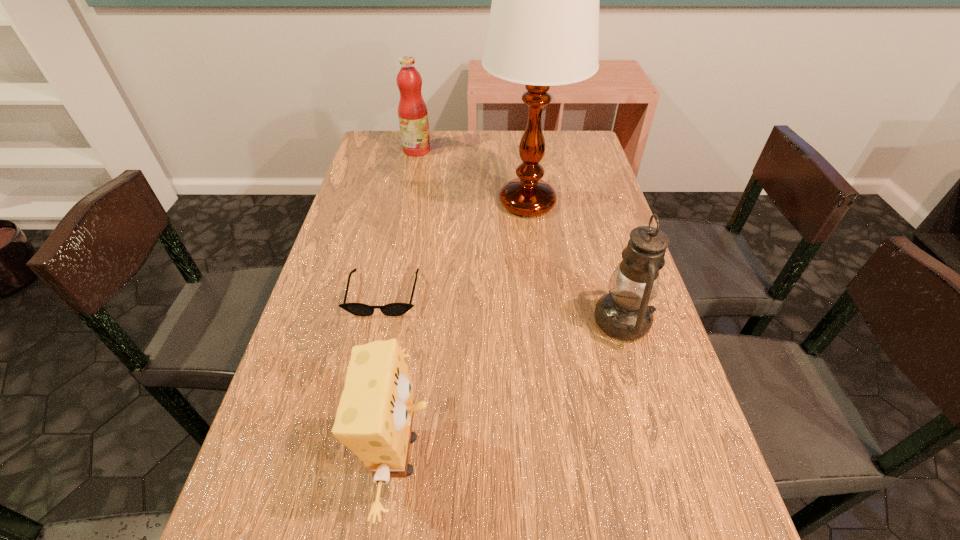
Identify the location of free space that is in between the second farthest object and the shortest object. The width and height of the screenshot is (960, 540). (455, 248).

Where is `free spot between the shortest object and the fruit juice`? free spot between the shortest object and the fruit juice is located at coordinates (400, 222).

Where is `vacant area that lies between the oil lamp and the farthest object`? The image size is (960, 540). vacant area that lies between the oil lamp and the farthest object is located at coordinates (x=519, y=235).

You are a GUI agent. You are given a task and a screenshot of the screen. Output one action in this format:
    pyautogui.click(x=<x>, y=<y>)
    Task: Click on the free area in between the second farthest object and the sunglasses
    The height and width of the screenshot is (540, 960).
    Given the screenshot: What is the action you would take?
    pyautogui.click(x=455, y=248)

Where is `vacant point located between the sunglasses and the oil lamp`? This screenshot has width=960, height=540. vacant point located between the sunglasses and the oil lamp is located at coordinates (503, 307).

Identify the location of object that is the closest to the fourth nearest object. (412, 111).

Select which object is the third closest to the farthest object. Please provide its 2D coordinates. Your answer should be formatted as a tuple, i.e. [(x, y)], where the tuple contains the x and y coordinates of a point satisfying the conditions above.

[(624, 313)]

This screenshot has height=540, width=960. Identify the location of free location that satisfies the following two spatial constraints: 1. on the front label of the fruit juice; 2. on the left side of the tallest object. (406, 202).

This screenshot has height=540, width=960. In order to click on vacant region that satisfies the following two spatial constraints: 1. on the front-facing side of the shortest object; 2. on the right side of the oil lamp in this screenshot , I will do `click(378, 321)`.

Locate an element on the screen. Image resolution: width=960 pixels, height=540 pixels. free space in the image that satisfies the following two spatial constraints: 1. on the front label of the second farthest object; 2. on the left side of the farthest object is located at coordinates (406, 202).